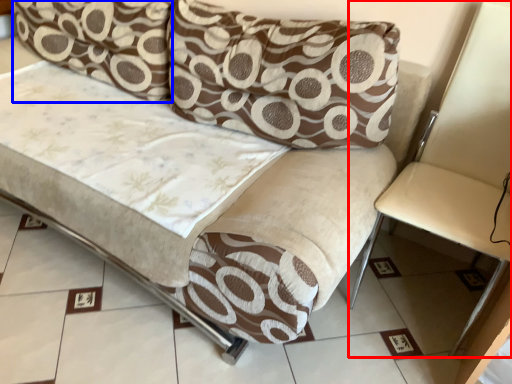
Question: Which object appears closest to the camera in this image, armchair (highlighted by a red box) or pillow (highlighted by a blue box)?

Choices:
 (A) armchair
 (B) pillow

Answer: (A)